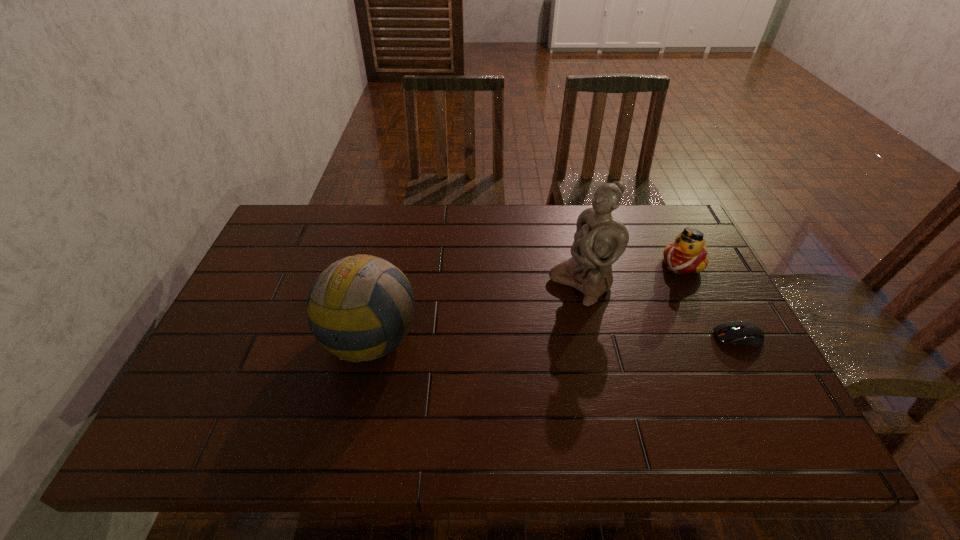
Locate an element on the screen. Image resolution: width=960 pixels, height=540 pixels. vacant space located 0.400m on the front-facing side of the second object from left to right is located at coordinates (435, 376).

This screenshot has height=540, width=960. Identify the location of free space located 0.260m on the front-facing side of the second object from left to right. (483, 347).

Identify the location of blank space located on the front-facing side of the second object from left to right. click(469, 355).

Image resolution: width=960 pixels, height=540 pixels. I want to click on free location located 0.070m on the face of the duck, so click(660, 285).

Find the location of a particular element. The height and width of the screenshot is (540, 960). blank area located on the face of the duck is located at coordinates (632, 312).

The height and width of the screenshot is (540, 960). I want to click on vacant area located on the face of the duck, so click(x=658, y=287).

You are a GUI agent. You are given a task and a screenshot of the screen. Output one action in this format:
    pyautogui.click(x=<x>, y=<y>)
    Task: Click on the object that is at the far edge
    
    Given the screenshot: What is the action you would take?
    pyautogui.click(x=688, y=254)

At what (x,y) coordinates should I click in order to perform the action: click on object positioned at the near edge. Please return your answer as a coordinate pair (x, y). This screenshot has height=540, width=960. Looking at the image, I should click on (360, 305).

Locate an element on the screen. The height and width of the screenshot is (540, 960). computer equipment present at the right edge is located at coordinates (745, 333).

The width and height of the screenshot is (960, 540). What are the coordinates of `duck that is at the right edge` in the screenshot? It's located at (688, 254).